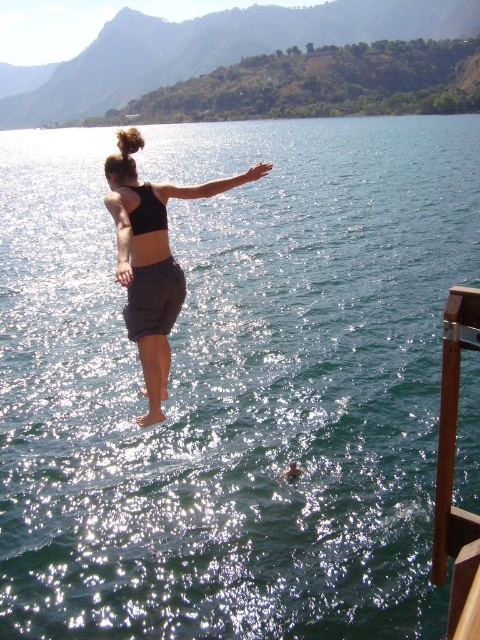
You are standing at the diving platform and see the brown wood boat at right located at point (453, 474). If you want to dive into the water directly in front of the brown wood boat at right, which direction should you aim for?

You should aim directly in front of the brown wood boat at right, which is located at point (453, 474). Since the coordinates indicate its position, diving towards that point will place you in front of it.

You are a photographer trying to capture the perfect shot of the diver. You notice the brown wood boat at right and the black matte bikini top at center. Based on their positions, which object is closer to the water surface?

The black matte bikini top at center is closer to the water surface because the brown wood boat at right is below it.

You are a photographer trying to capture the diver midair. You see the brown wood boat at right in the image. Where should you position your camera to ensure the boat is in the frame?

The brown wood boat at right is located at point (453, 474). Position your camera to include this coordinate in the frame to capture the boat along with the diver.